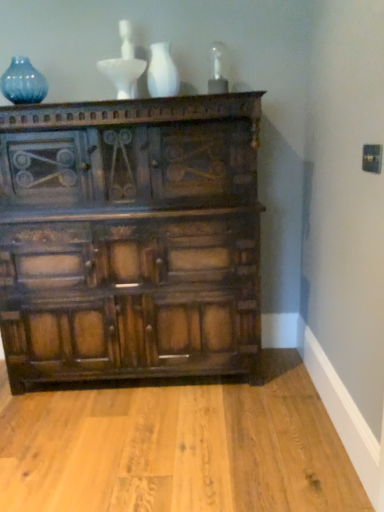
Question: Are white glossy vase at upper center and dark wood chest of drawers at center located far from each other?

Choices:
 (A) no
 (B) yes

Answer: (A)

Question: Considering the relative sizes of white glossy vase at upper center and dark wood chest of drawers at center in the image provided, is white glossy vase at upper center thinner than dark wood chest of drawers at center?

Choices:
 (A) yes
 (B) no

Answer: (A)

Question: Does white glossy vase at upper center have a greater height compared to dark wood chest of drawers at center?

Choices:
 (A) yes
 (B) no

Answer: (B)

Question: From a real-world perspective, is white glossy vase at upper center below dark wood chest of drawers at center?

Choices:
 (A) yes
 (B) no

Answer: (B)

Question: Is dark wood chest of drawers at center located within white glossy vase at upper center?

Choices:
 (A) yes
 (B) no

Answer: (B)

Question: Which is correct: dark wood chest of drawers at center is inside white glossy vase at upper center, or outside of it?

Choices:
 (A) inside
 (B) outside

Answer: (B)

Question: Is point click(170, 183) positioned closer to the camera than point click(165, 79)?

Choices:
 (A) farther
 (B) closer

Answer: (A)

Question: Is dark wood chest of drawers at center in front of or behind white glossy vase at upper center in the image?

Choices:
 (A) front
 (B) behind

Answer: (A)

Question: From the image's perspective, is dark wood chest of drawers at center positioned above or below white glossy vase at upper center?

Choices:
 (A) below
 (B) above

Answer: (A)

Question: Would you say blue glass vase at upper left is to the left or to the right of dark wood chest of drawers at center in the picture?

Choices:
 (A) right
 (B) left

Answer: (B)

Question: Is blue glass vase at upper left taller or shorter than dark wood chest of drawers at center?

Choices:
 (A) tall
 (B) short

Answer: (B)

Question: Is point (11, 83) closer or farther from the camera than point (36, 300)?

Choices:
 (A) farther
 (B) closer

Answer: (A)

Question: From the image's perspective, relative to dark wood chest of drawers at center, is blue glass vase at upper left above or below?

Choices:
 (A) below
 (B) above

Answer: (B)

Question: Is blue glass vase at upper left situated inside white glossy vase at upper center or outside?

Choices:
 (A) outside
 (B) inside

Answer: (A)

Question: From the image's perspective, is blue glass vase at upper left above or below white glossy vase at upper center?

Choices:
 (A) below
 (B) above

Answer: (B)